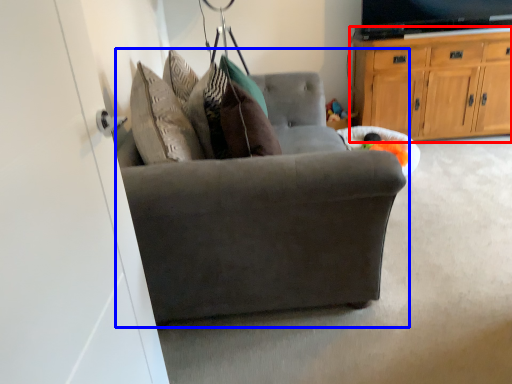
Question: Which object is further to the camera taking this photo, cabinetry (highlighted by a red box) or chair (highlighted by a blue box)?

Choices:
 (A) cabinetry
 (B) chair

Answer: (A)